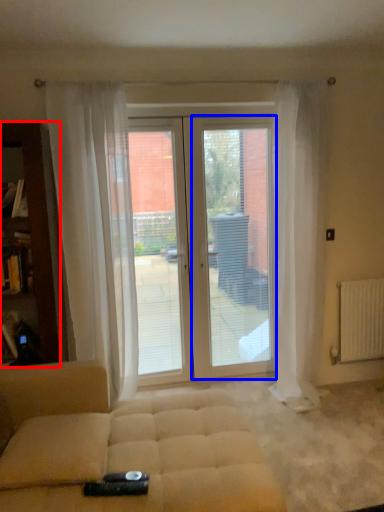
Question: Among these objects, which one is nearest to the camera, cabinetry (highlighted by a red box) or screen door (highlighted by a blue box)?

Choices:
 (A) cabinetry
 (B) screen door

Answer: (A)